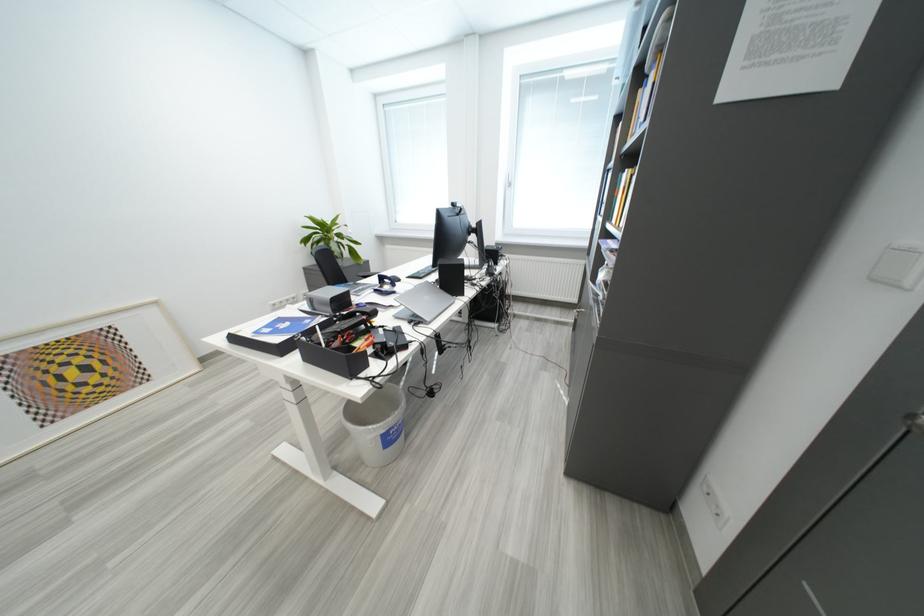
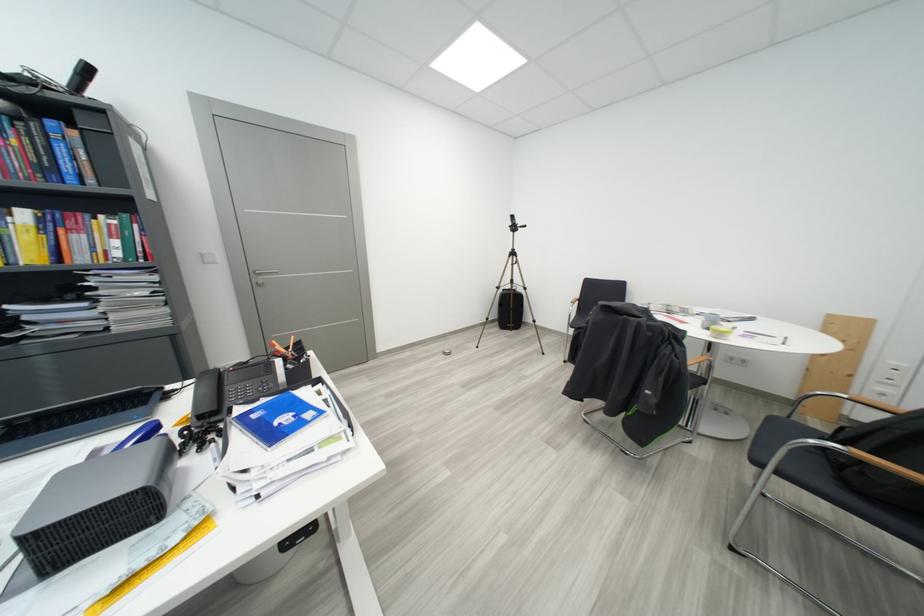
Where in the second image is the point corresponding to [317,323] from the first image?

(263, 419)